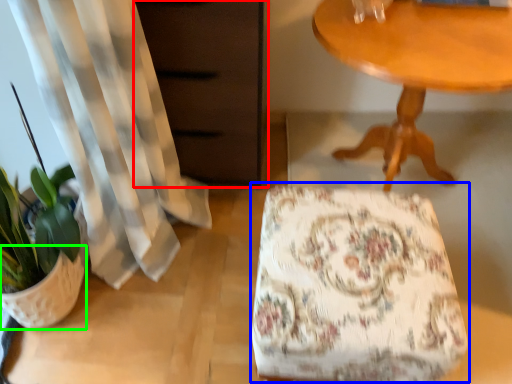
Question: Considering the real-world distances, which object is closest to dresser (highlighted by a red box)? rocking chair (highlighted by a blue box) or flowerpot (highlighted by a green box).

Choices:
 (A) rocking chair
 (B) flowerpot

Answer: (A)